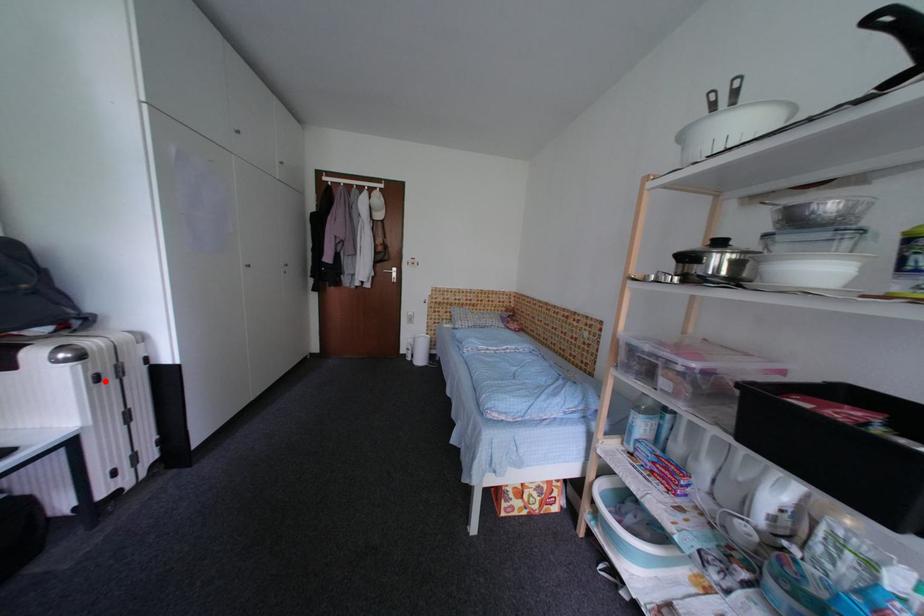
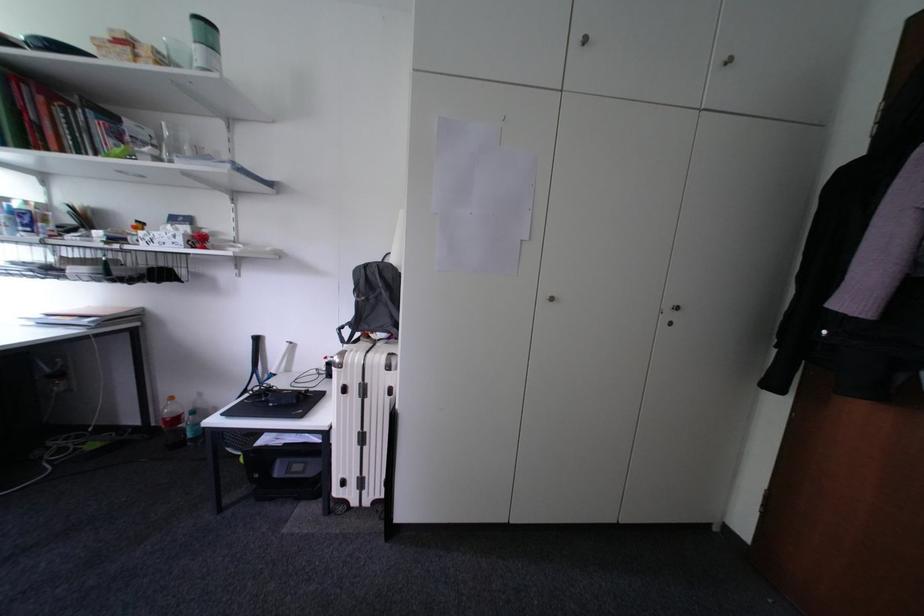
Where in the second image is the point corresponding to the highlighted location from the first image?

(353, 392)